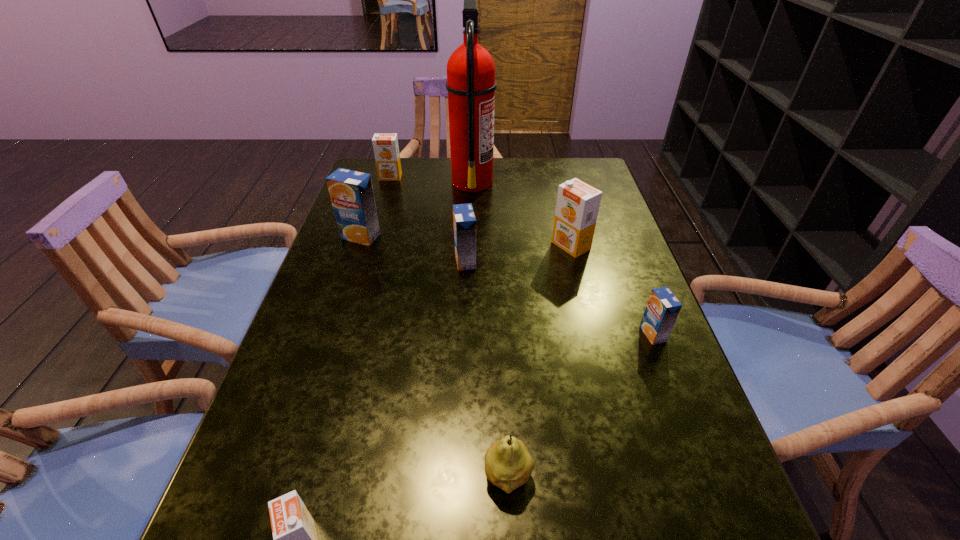
Find the location of a particular element. This screenshot has height=540, width=960. free space that satisfies the following two spatial constraints: 1. on the side of the tallest object near the handle; 2. on the right side of the second nearest orange juice is located at coordinates (468, 334).

Find the location of `free spot that satisfies the following two spatial constraints: 1. on the side of the tallest object near the handle; 2. on the back side of the rightmost blue orange_juice`. free spot that satisfies the following two spatial constraints: 1. on the side of the tallest object near the handle; 2. on the back side of the rightmost blue orange_juice is located at coordinates (468, 334).

Image resolution: width=960 pixels, height=540 pixels. Find the location of `vacant area in the image that satisfies the following two spatial constraints: 1. on the side of the tallest object near the handle; 2. on the back side of the rightmost blue orange_juice`. vacant area in the image that satisfies the following two spatial constraints: 1. on the side of the tallest object near the handle; 2. on the back side of the rightmost blue orange_juice is located at coordinates (468, 334).

The height and width of the screenshot is (540, 960). Find the location of `free point that satisfies the following two spatial constraints: 1. on the side of the tallest object near the handle; 2. on the left side of the pear`. free point that satisfies the following two spatial constraints: 1. on the side of the tallest object near the handle; 2. on the left side of the pear is located at coordinates (465, 476).